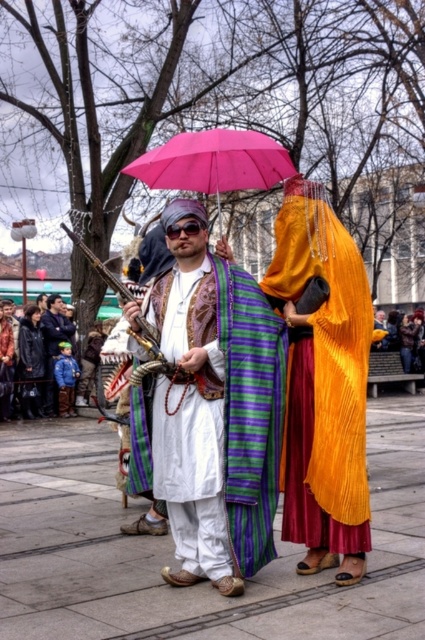
You are standing on the smooth concrete pavement at center. Which direction should you walk to reach the point represented by point [172,548]?

The point [172,548] is the location of the smooth concrete pavement at center, so you are already standing on it. There is no need to walk further.

You are standing at the edge of the scene and want to walk to the smooth concrete pavement at center. According to the coordinates provided, which direction should you move to reach it?

The smooth concrete pavement at center is located at coordinates point [172,548]. Since you are at the edge, you should move towards the center of the scene to reach it.

You are an event photographer trying to capture a clear photo of both the matte purple striped robe at center and the leather jacket at center. Since they are positioned close to each other, will you need to adjust your focus to ensure both are in focus?

The matte purple striped robe at center is in front of the leather jacket at center, so you will need to adjust your focus to ensure both are in focus as they are layered.